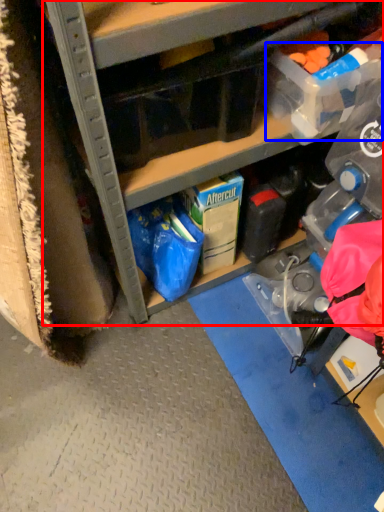
Question: Among these objects, which one is farthest to the camera, cabinetry (highlighted by a red box) or storage box (highlighted by a blue box)?

Choices:
 (A) cabinetry
 (B) storage box

Answer: (B)